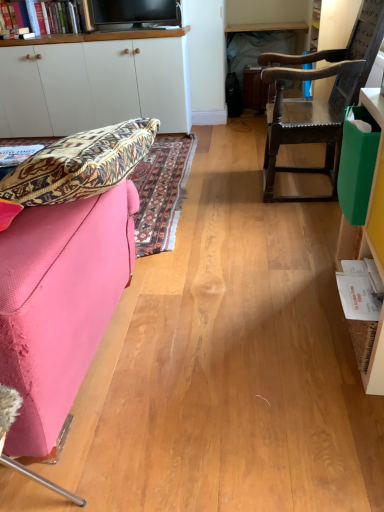
The width and height of the screenshot is (384, 512). I want to click on free area below white paper book at right, which appears as the 2th book when viewed from the back (from a real-world perspective), so click(342, 346).